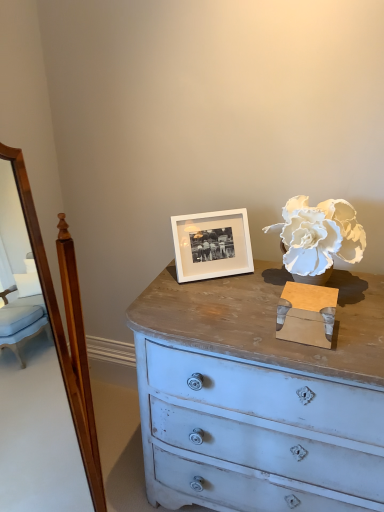
Question: Does white paper flower at upper right have a lesser width compared to white matte picture frame at center?

Choices:
 (A) yes
 (B) no

Answer: (B)

Question: From a real-world perspective, is white paper flower at upper right positioned over white matte picture frame at center based on gravity?

Choices:
 (A) yes
 (B) no

Answer: (A)

Question: Is white paper flower at upper right beside white matte picture frame at center?

Choices:
 (A) yes
 (B) no

Answer: (B)

Question: Does white paper flower at upper right lie in front of white matte picture frame at center?

Choices:
 (A) yes
 (B) no

Answer: (A)

Question: Is white paper flower at upper right aimed at white matte picture frame at center?

Choices:
 (A) no
 (B) yes

Answer: (A)

Question: Is white paper flower at upper right smaller than white matte picture frame at center?

Choices:
 (A) yes
 (B) no

Answer: (B)

Question: From the image's perspective, is white matte picture frame at center beneath white paper flower at upper right?

Choices:
 (A) yes
 (B) no

Answer: (A)

Question: Does white matte picture frame at center have a lesser width compared to white paper flower at upper right?

Choices:
 (A) no
 (B) yes

Answer: (B)

Question: From a real-world perspective, is white matte picture frame at center physically above white paper flower at upper right?

Choices:
 (A) no
 (B) yes

Answer: (A)

Question: Is white matte picture frame at center touching white paper flower at upper right?

Choices:
 (A) no
 (B) yes

Answer: (A)

Question: Is white matte picture frame at center positioned with its back to white paper flower at upper right?

Choices:
 (A) no
 (B) yes

Answer: (A)

Question: Is white matte picture frame at center positioned in front of white paper flower at upper right?

Choices:
 (A) yes
 (B) no

Answer: (B)

Question: From the image's perspective, is white paper flower at upper right above or below white matte picture frame at center?

Choices:
 (A) above
 (B) below

Answer: (A)